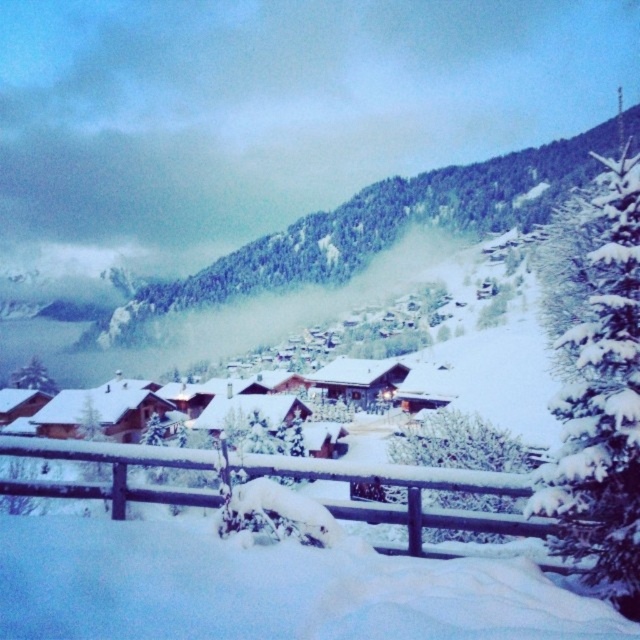
Question: Among these objects, which one is farthest from the camera?

Choices:
 (A) white snow-covered tree at center
 (B) snowy forested mountain at center

Answer: (B)

Question: Does snowy forested mountain at center have a greater width compared to green matte tree at left?

Choices:
 (A) yes
 (B) no

Answer: (A)

Question: Among these points, which one is nearest to the camera?

Choices:
 (A) (38, 374)
 (B) (589, 276)
 (C) (52, 493)
 (D) (428, 435)

Answer: (C)

Question: In this image, where is snowy forested mountain at center located relative to green matte tree at left?

Choices:
 (A) left
 (B) right

Answer: (B)

Question: Which point is closer to the camera?

Choices:
 (A) (456, 424)
 (B) (29, 358)
 (C) (65, 488)
 (D) (563, 412)

Answer: (D)

Question: Does wooden fence at lower center have a larger size compared to white snow-covered tree at center?

Choices:
 (A) yes
 (B) no

Answer: (B)